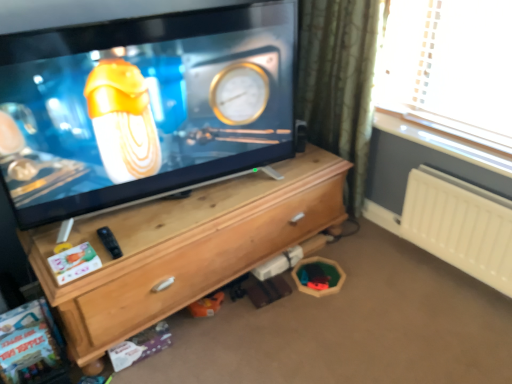
Where is `green textured curtain at upper right`? green textured curtain at upper right is located at coordinates (338, 82).

The image size is (512, 384). I want to click on white plastic radiator at right, so click(x=460, y=225).

Where is `matte black tv at center`? matte black tv at center is located at coordinates (143, 106).

Would you say matte black tv at center is inside or outside green textured curtain at upper right?

matte black tv at center exists outside the volume of green textured curtain at upper right.

Looking at this image, is there a large distance between matte black tv at center and green textured curtain at upper right?

No.

Between matte black tv at center and green textured curtain at upper right, which one has smaller size?

With smaller size is matte black tv at center.

Does matte black tv at center have a greater height compared to wooden chest of drawers at center?

Correct, matte black tv at center is much taller as wooden chest of drawers at center.

Looking at this image, is matte black tv at center at the left side of wooden chest of drawers at center?

Yes, matte black tv at center is to the left of wooden chest of drawers at center.

Based on the photo, between matte black tv at center and wooden chest of drawers at center, which one has larger size?

Bigger between the two is wooden chest of drawers at center.

Which is in front, point (198, 100) or point (187, 200)?

The point (198, 100) is closer to the camera.

Considering the sizes of objects white plastic radiator at right and green textured curtain at upper right in the image provided, who is smaller, white plastic radiator at right or green textured curtain at upper right?

Smaller between the two is white plastic radiator at right.

In the scene shown: From the image's perspective, is white plastic radiator at right located beneath green textured curtain at upper right?

Indeed, from the image's perspective, white plastic radiator at right is shown beneath green textured curtain at upper right.

Is white plastic radiator at right taller or shorter than green textured curtain at upper right?

white plastic radiator at right is shorter than green textured curtain at upper right.

How much distance is there between white plastic radiator at right and green textured curtain at upper right?

white plastic radiator at right is 24.07 inches from green textured curtain at upper right.

Is wooden chest of drawers at center next to white plastic radiator at right?

No, wooden chest of drawers at center is not making contact with white plastic radiator at right.

Considering the relative sizes of wooden chest of drawers at center and white plastic radiator at right in the image provided, is wooden chest of drawers at center shorter than white plastic radiator at right?

In fact, wooden chest of drawers at center may be taller than white plastic radiator at right.

Considering the relative sizes of wooden chest of drawers at center and white plastic radiator at right in the image provided, is wooden chest of drawers at center thinner than white plastic radiator at right?

Incorrect, the width of wooden chest of drawers at center is not less than that of white plastic radiator at right.

From the image's perspective, between wooden chest of drawers at center and white plastic radiator at right, which one is located above?

white plastic radiator at right appears higher in the image.

Is wooden chest of drawers at center looking in the opposite direction of green textured curtain at upper right?

No, wooden chest of drawers at center is not facing the opposite direction of green textured curtain at upper right.

Can you confirm if wooden chest of drawers at center is bigger than green textured curtain at upper right?

Yes, wooden chest of drawers at center is bigger than green textured curtain at upper right.

From the image's perspective, between wooden chest of drawers at center and green textured curtain at upper right, which one is located above?

green textured curtain at upper right is shown above in the image.

Find the location of a particular element. This screenshot has height=384, width=512. curtain behind the wooden chest of drawers at center is located at coordinates (338, 82).

Based on the photo, which point is more distant from viewer, (471,224) or (39,92)?

The point (471,224) is more distant.

Looking at this image, what's the angular difference between white plastic radiator at right and matte black tv at center's facing directions?

They differ by 77.7 degrees in their facing directions.

Are white plastic radiator at right and matte black tv at center far apart?

white plastic radiator at right is positioned a significant distance from matte black tv at center.

Relative to wooden chest of drawers at center, is white plastic radiator at right in front or behind?

Visually, white plastic radiator at right is located behind wooden chest of drawers at center.

Is white plastic radiator at right outside of wooden chest of drawers at center?

Yes, white plastic radiator at right is not within wooden chest of drawers at center.

Can you confirm if white plastic radiator at right is positioned to the left of wooden chest of drawers at center?

In fact, white plastic radiator at right is to the right of wooden chest of drawers at center.

Where is `curtain below the matte black tv at center (from a real-world perspective)`? curtain below the matte black tv at center (from a real-world perspective) is located at coordinates (338, 82).

Locate an element on the screen. television to the left of wooden chest of drawers at center is located at coordinates (143, 106).

Estimate the real-world distances between objects in this image. Which object is closer to white plastic radiator at right, wooden chest of drawers at center or green textured curtain at upper right?

The object closer to white plastic radiator at right is green textured curtain at upper right.

Which object lies nearer to the anchor point wooden chest of drawers at center, green textured curtain at upper right or matte black tv at center?

matte black tv at center lies closer to wooden chest of drawers at center than the other object.

Estimate the real-world distances between objects in this image. Which object is further from matte black tv at center, wooden chest of drawers at center or green textured curtain at upper right?

The object further to matte black tv at center is green textured curtain at upper right.

Estimate the real-world distances between objects in this image. Which object is further from green textured curtain at upper right, matte black tv at center or white plastic radiator at right?

Among the two, matte black tv at center is located further to green textured curtain at upper right.

From the image, which object appears to be nearer to wooden chest of drawers at center, matte black tv at center or white plastic radiator at right?

Among the two, matte black tv at center is located nearer to wooden chest of drawers at center.

Estimate the real-world distances between objects in this image. Which object is closer to matte black tv at center, white plastic radiator at right or wooden chest of drawers at center?

wooden chest of drawers at center is positioned closer to the anchor matte black tv at center.

Based on their spatial positions, is matte black tv at center or green textured curtain at upper right closer to white plastic radiator at right?

green textured curtain at upper right is closer to white plastic radiator at right.

Looking at the image, which one is located further to white plastic radiator at right, wooden chest of drawers at center or matte black tv at center?

matte black tv at center is further to white plastic radiator at right.

This screenshot has width=512, height=384. What are the coordinates of `the chest of drawers located between matte black tv at center and green textured curtain at upper right in the left-right direction` in the screenshot? It's located at (185, 248).

The height and width of the screenshot is (384, 512). I want to click on curtain located between matte black tv at center and white plastic radiator at right in the left-right direction, so click(338, 82).

Locate an element on the screen. This screenshot has width=512, height=384. chest of drawers between matte black tv at center and white plastic radiator at right from left to right is located at coordinates click(x=185, y=248).

You are a GUI agent. You are given a task and a screenshot of the screen. Output one action in this format:
    pyautogui.click(x=<x>, y=<y>)
    Task: Click on the curtain situated between wooden chest of drawers at center and white plastic radiator at right from left to right
    Image resolution: width=512 pixels, height=384 pixels.
    Given the screenshot: What is the action you would take?
    pyautogui.click(x=338, y=82)